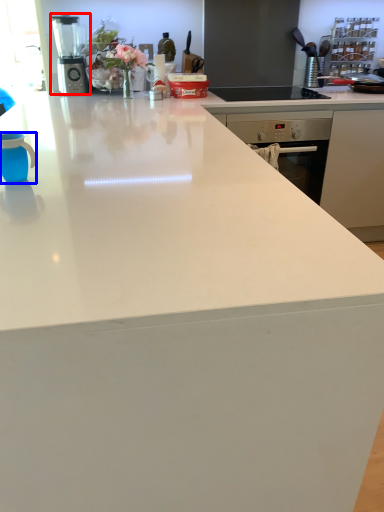
Question: Which object appears farthest to the camera in this image, kitchen appliance (highlighted by a red box) or mug (highlighted by a blue box)?

Choices:
 (A) kitchen appliance
 (B) mug

Answer: (A)